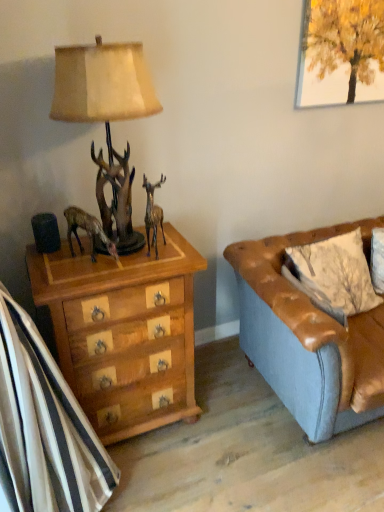
Identify the location of vacant area that lies in front of antique brown statue at left. (83, 274).